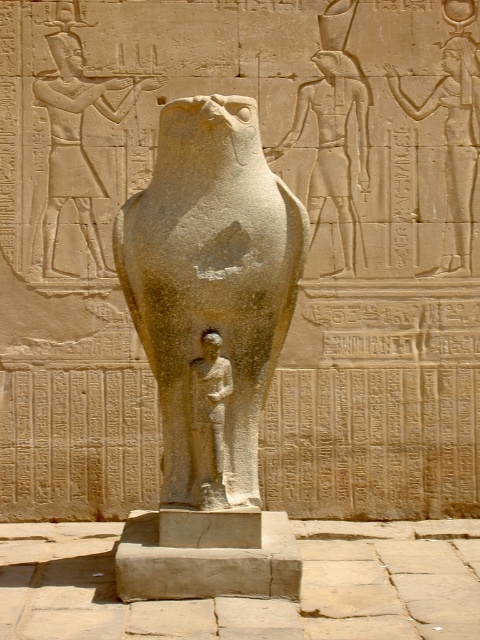
Question: Is gray stone statue at center smaller than sandstone relief figure at upper left?

Choices:
 (A) yes
 (B) no

Answer: (A)

Question: Based on their relative distances, which object is nearer to the gray stone falcon at center?

Choices:
 (A) sandstone relief figure at upper left
 (B) gray stone statue at center

Answer: (A)

Question: Which object is positioned closest to the gray stone statue at center?

Choices:
 (A) sandstone relief figure at upper left
 (B) gray stone falcon at center

Answer: (A)

Question: Can you confirm if gray stone falcon at center is wider than gray stone statue at center?

Choices:
 (A) yes
 (B) no

Answer: (A)

Question: Considering the real-world distances, which object is farthest from the gray stone statue at center?

Choices:
 (A) gray stone falcon at center
 (B) sandstone relief figure at upper left

Answer: (A)

Question: Is gray stone statue at center further to the viewer compared to sandstone relief figure at upper left?

Choices:
 (A) no
 (B) yes

Answer: (B)